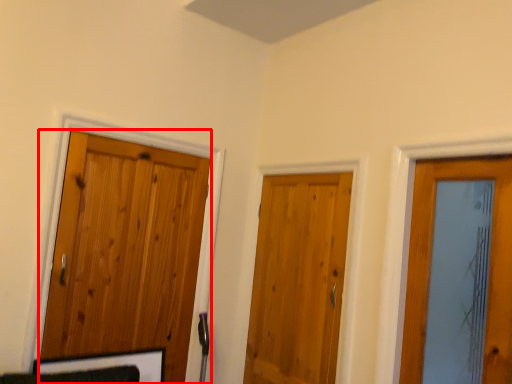
Question: Observing the image, what is the correct spatial positioning of door (annotated by the red box) in reference to door?

Choices:
 (A) left
 (B) right

Answer: (A)